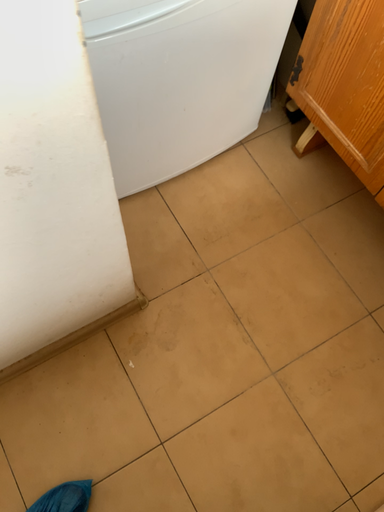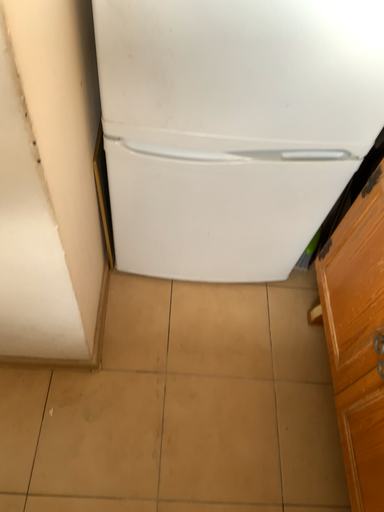
Question: Which way did the camera rotate in the video?

Choices:
 (A) rotated downward
 (B) rotated upward

Answer: (B)